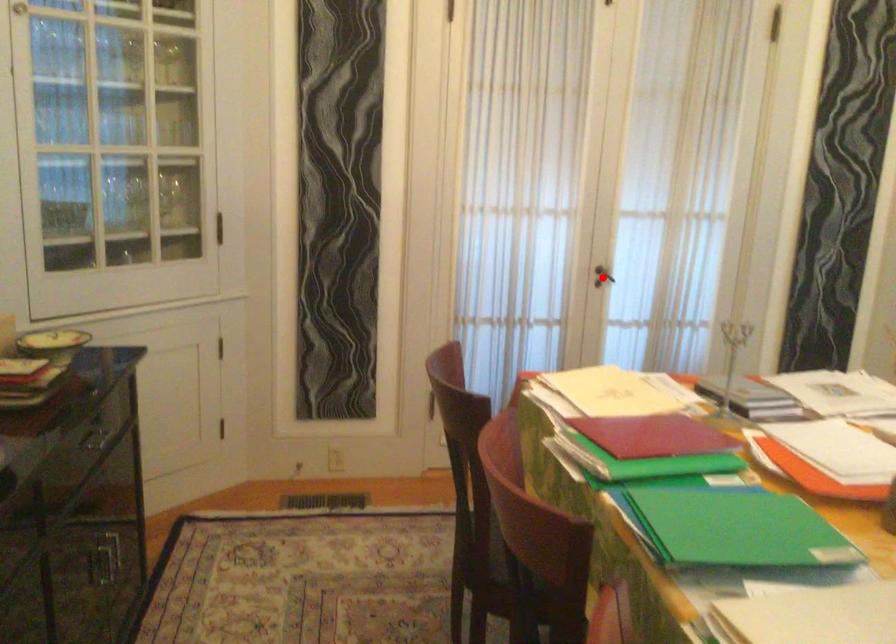
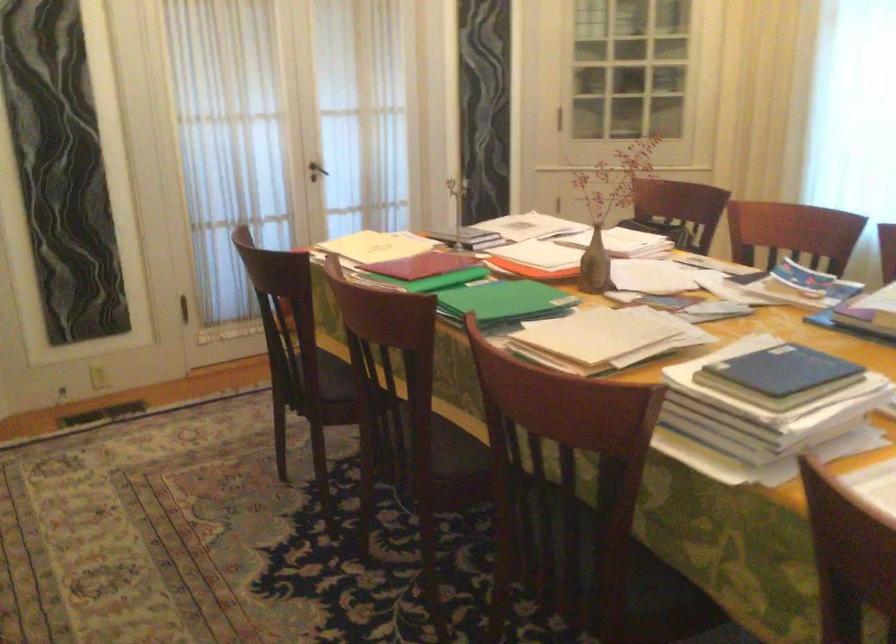
Question: I am providing you with two images of the same scene from different viewpoints. A red point is shown in image1. For the corresponding object point in image2, is it positioned nearer or farther from the camera?

Choices:
 (A) Nearer
 (B) Farther

Answer: (B)